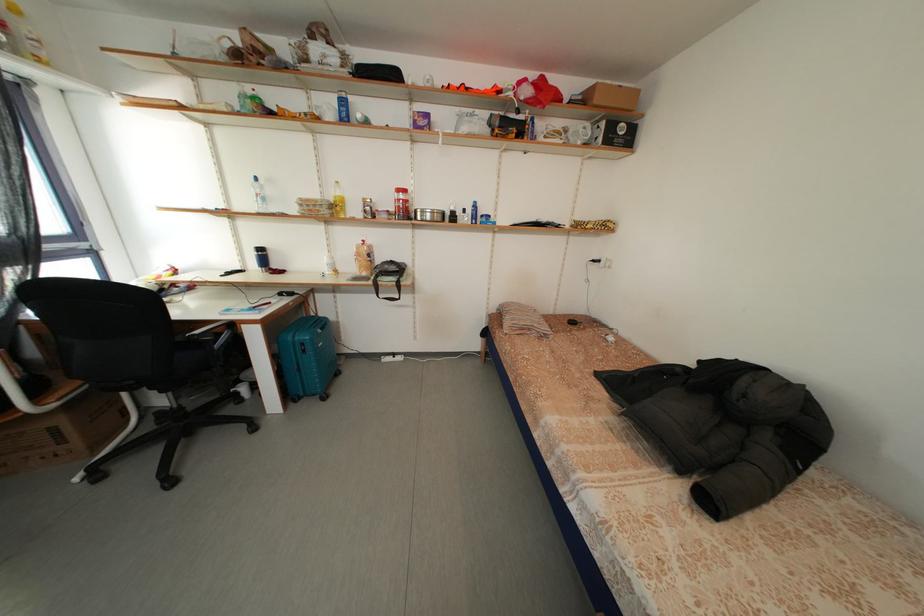
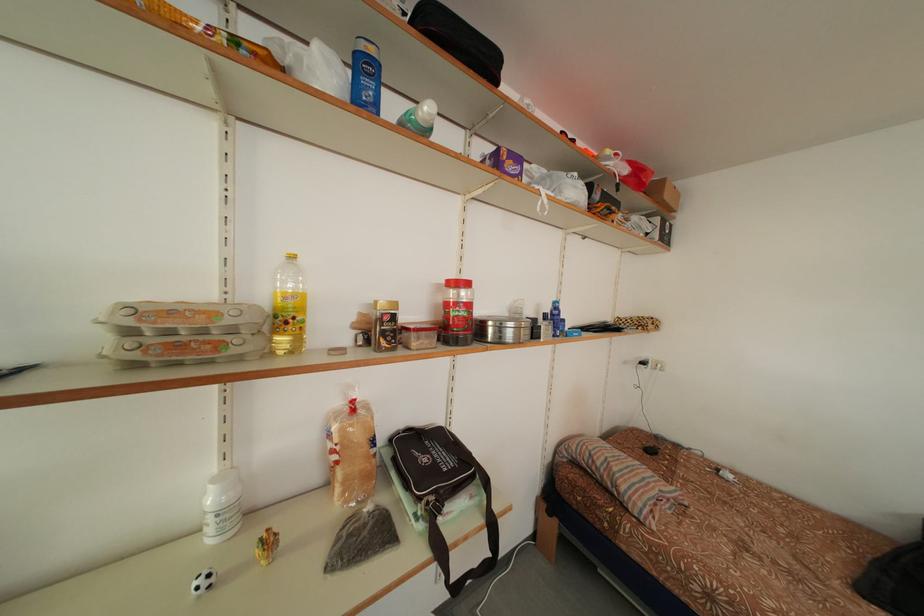
The point at (371, 246) is marked in the first image. Where is the corresponding point in the second image?

(360, 407)